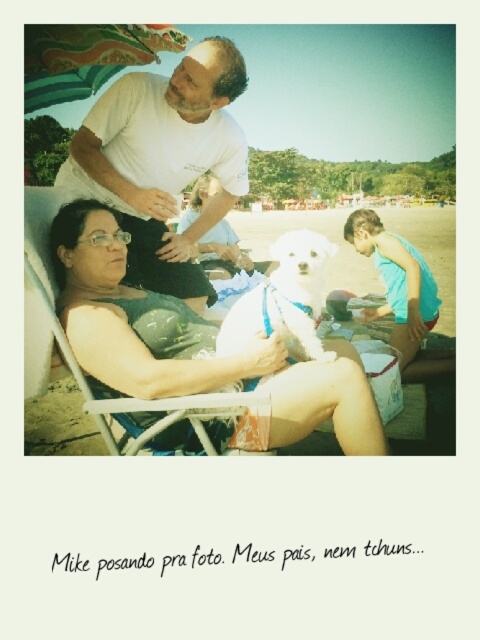
You are standing at the origin point in the image. Which of the two points, point (199, 109) or point (294, 241), is farther away from you?

Point (199, 109) is behind point (294, 241), so it is farther away from you.

You are a photographer trying to capture a closeup of the white fluffy dog at center. The matte black swimsuit at center is blocking your view. Can you move the dog to the side so that the dog is no longer behind the swimsuit?

The matte black swimsuit at center is taller than the white fluffy dog at center, so moving the dog to the side might not fully avoid the obstruction since the swimsuit is taller. However, adjusting the angle or position could help capture the dog without the swimsuit blocking the view.